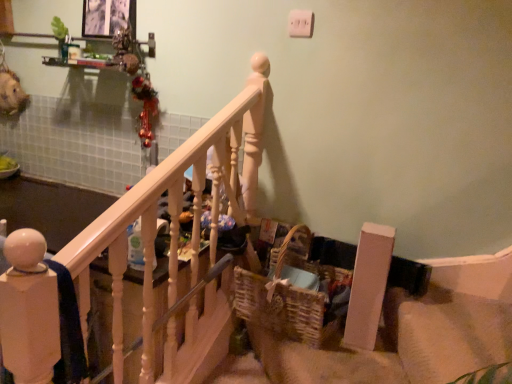
Question: From the image's perspective, does woven brown basket at lower center appear lower than white painted wood railing at upper left?

Choices:
 (A) yes
 (B) no

Answer: (A)

Question: Does woven brown basket at lower center have a greater height compared to white painted wood railing at upper left?

Choices:
 (A) yes
 (B) no

Answer: (B)

Question: Is the position of woven brown basket at lower center less distant than that of white painted wood railing at upper left?

Choices:
 (A) yes
 (B) no

Answer: (B)

Question: Considering the relative positions of woven brown basket at lower center and white painted wood railing at upper left in the image provided, is woven brown basket at lower center to the right of white painted wood railing at upper left from the viewer's perspective?

Choices:
 (A) no
 (B) yes

Answer: (B)

Question: Does woven brown basket at lower center lie behind white painted wood railing at upper left?

Choices:
 (A) yes
 (B) no

Answer: (A)

Question: From a real-world perspective, is woven brown basket at lower center physically below white painted wood railing at upper left?

Choices:
 (A) no
 (B) yes

Answer: (B)

Question: From the image's perspective, does white painted wood railing at upper left appear lower than woven brown basket at lower center?

Choices:
 (A) no
 (B) yes

Answer: (A)

Question: Can you confirm if white painted wood railing at upper left is positioned to the right of woven brown basket at lower center?

Choices:
 (A) no
 (B) yes

Answer: (A)

Question: Can you confirm if white painted wood railing at upper left is wider than woven brown basket at lower center?

Choices:
 (A) no
 (B) yes

Answer: (A)

Question: Is white painted wood railing at upper left not within woven brown basket at lower center?

Choices:
 (A) yes
 (B) no

Answer: (A)

Question: From a real-world perspective, is white painted wood railing at upper left located higher than woven brown basket at lower center?

Choices:
 (A) no
 (B) yes

Answer: (B)

Question: Can you confirm if white painted wood railing at upper left is positioned to the left of woven brown basket at lower center?

Choices:
 (A) no
 (B) yes

Answer: (B)

Question: Is woven brown basket at lower center wider or thinner than white painted wood railing at upper left?

Choices:
 (A) wide
 (B) thin

Answer: (A)